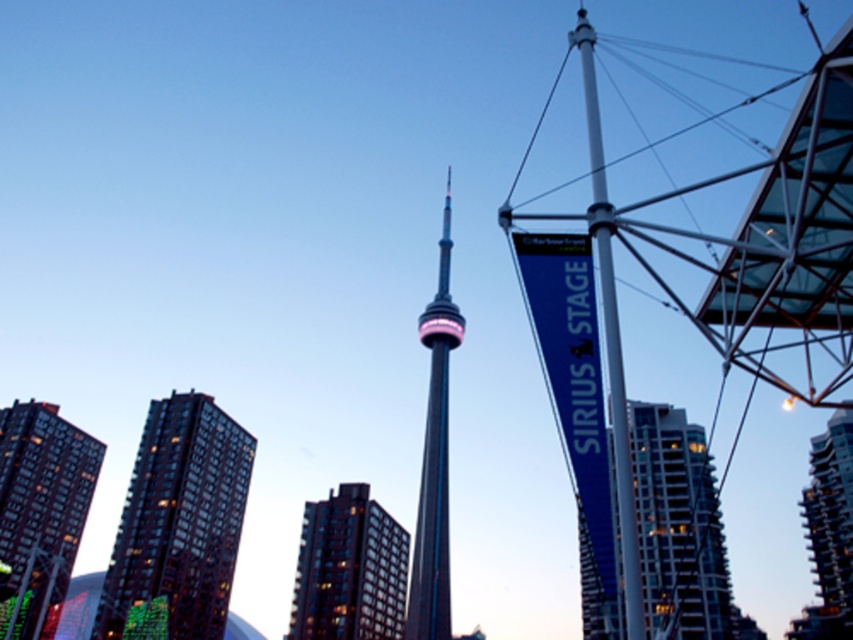
Does glassy reflective skyscraper at center appear on the right side of white metallic pole at center?

Yes, glassy reflective skyscraper at center is to the right of white metallic pole at center.

Who is positioned more to the left, glassy reflective skyscraper at center or white metallic pole at center?

From the viewer's perspective, white metallic pole at center appears more on the left side.

Is point (647, 538) behind point (616, 461)?

That is True.

You are a GUI agent. You are given a task and a screenshot of the screen. Output one action in this format:
    pyautogui.click(x=<x>, y=<y>)
    Task: Click on the glassy reflective skyscraper at center
    The height and width of the screenshot is (640, 853).
    Given the screenshot: What is the action you would take?
    pyautogui.click(x=680, y=531)

Does dark brown glass building at center have a larger size compared to shiny metallic tower at center?

Yes, dark brown glass building at center is bigger than shiny metallic tower at center.

What do you see at coordinates (349, 570) in the screenshot? The height and width of the screenshot is (640, 853). I see `dark brown glass building at center` at bounding box center [349, 570].

Is point (379, 588) positioned before point (426, 544)?

That is False.

Find the location of `dark brown glass building at center`. dark brown glass building at center is located at coordinates (349, 570).

Is dark glass building at left smaller than glassy reflective skyscraper at center?

Yes.

Which is behind, point (170, 476) or point (589, 620)?

Positioned behind is point (170, 476).

Where is `dark glass building at left`? dark glass building at left is located at coordinates (180, 518).